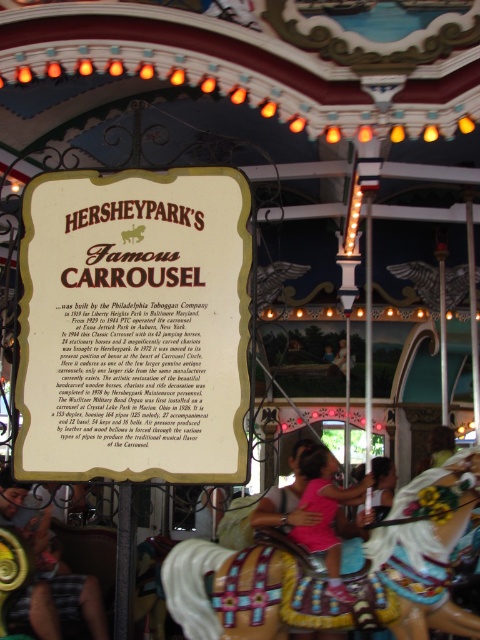
Is white paper sign at center taller than wooden painted horse at center?

Correct, white paper sign at center is much taller as wooden painted horse at center.

Based on the photo, who is taller, white paper sign at center or wooden painted horse at center?

With more height is white paper sign at center.

What do you see at coordinates (133, 326) in the screenshot?
I see `white paper sign at center` at bounding box center [133, 326].

In order to click on white paper sign at center in this screenshot , I will do `click(133, 326)`.